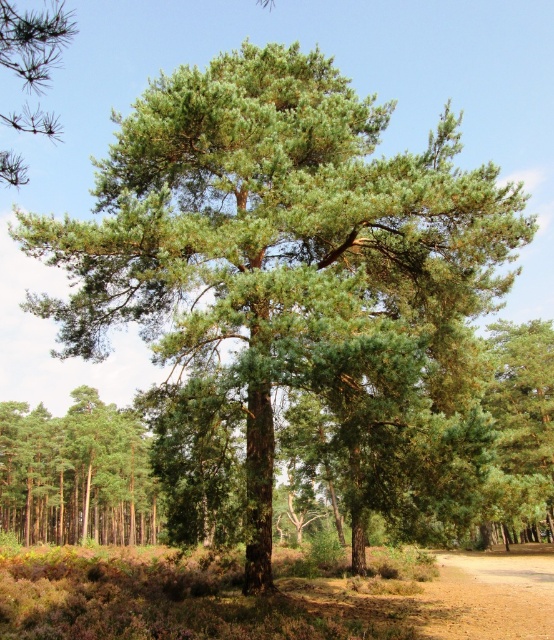
You are standing in the forest and see a point marked at coordinates (75, 474). Based on the scene description, what object is located at this point?

The point at coordinates (75, 474) corresponds to the green smooth tree at left.